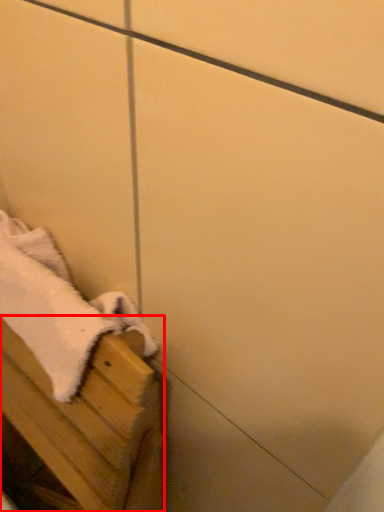
Question: In this image, where is furniture (annotated by the red box) located relative to bath towel?

Choices:
 (A) left
 (B) right

Answer: (A)